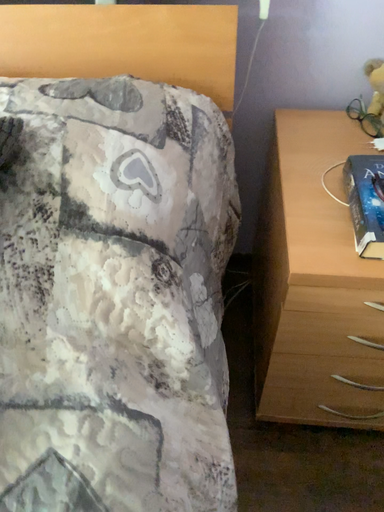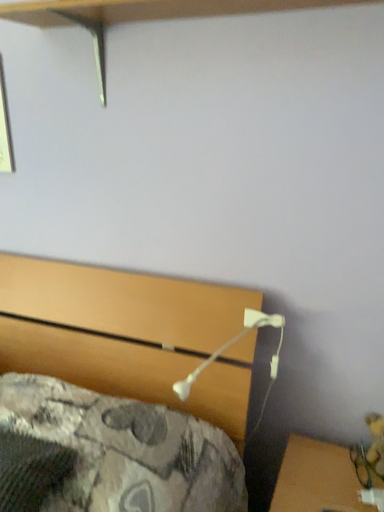
Question: Which way did the camera rotate in the video?

Choices:
 (A) rotated left
 (B) rotated right

Answer: (A)